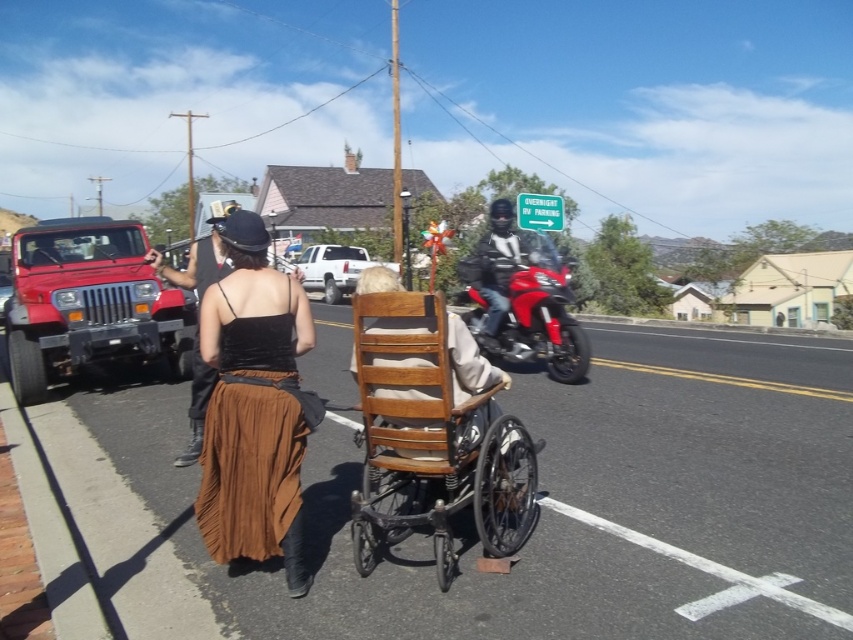
Question: Which point is farther to the camera?

Choices:
 (A) (486, 426)
 (B) (515, 262)
 (C) (544, 348)

Answer: (C)

Question: Does shiny red motorcycle at center have a lesser width compared to shiny black motorcycle at center?

Choices:
 (A) yes
 (B) no

Answer: (B)

Question: Is shiny red motorcycle at center to the right of shiny black motorcycle at center from the viewer's perspective?

Choices:
 (A) yes
 (B) no

Answer: (A)

Question: Estimate the real-world distances between objects in this image. Which object is closer to the matte red jeep at left?

Choices:
 (A) matte black hat at upper center
 (B) shiny black motorcycle at center
 (C) white matte truck at center

Answer: (A)

Question: Observing the image, what is the correct spatial positioning of matte black hat at upper center in reference to white matte truck at center?

Choices:
 (A) above
 (B) below

Answer: (A)

Question: Based on their relative distances, which object is nearer to the matte black hat at upper center?

Choices:
 (A) shiny black motorcycle at center
 (B) matte red jeep at left
 (C) brown suede skirt at center
 (D) shiny red motorcycle at center

Answer: (C)